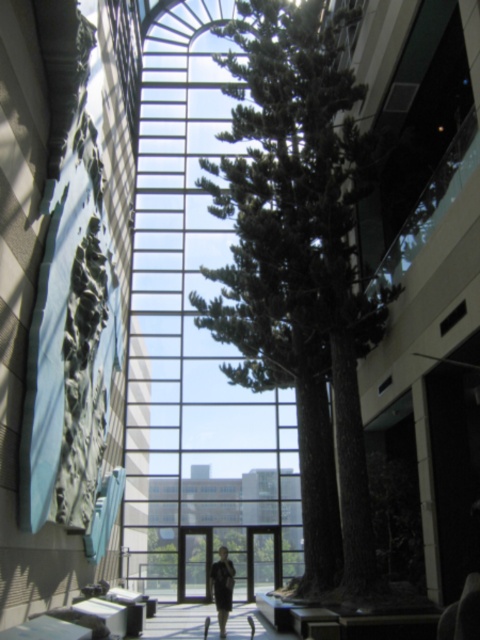
This screenshot has height=640, width=480. What do you see at coordinates (300, 266) in the screenshot? I see `green textured tree at center` at bounding box center [300, 266].

Which of these two, green textured tree at center or dark gray suit at center, stands shorter?

dark gray suit at center

Is point (323, 397) farther from viewer compared to point (211, 579)?

That is False.

Image resolution: width=480 pixels, height=640 pixels. In order to click on green textured tree at center in this screenshot , I will do `click(300, 266)`.